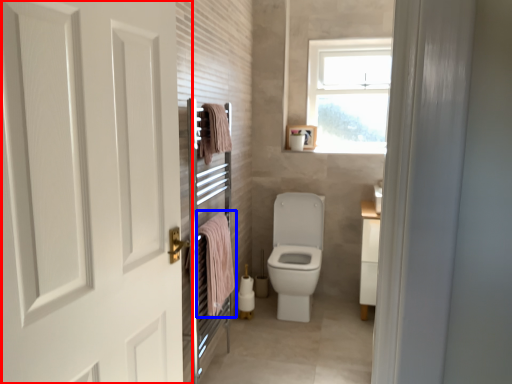
Question: Which point is closer to the camera, door (highlighted by a red box) or bath towel (highlighted by a blue box)?

Choices:
 (A) door
 (B) bath towel

Answer: (A)